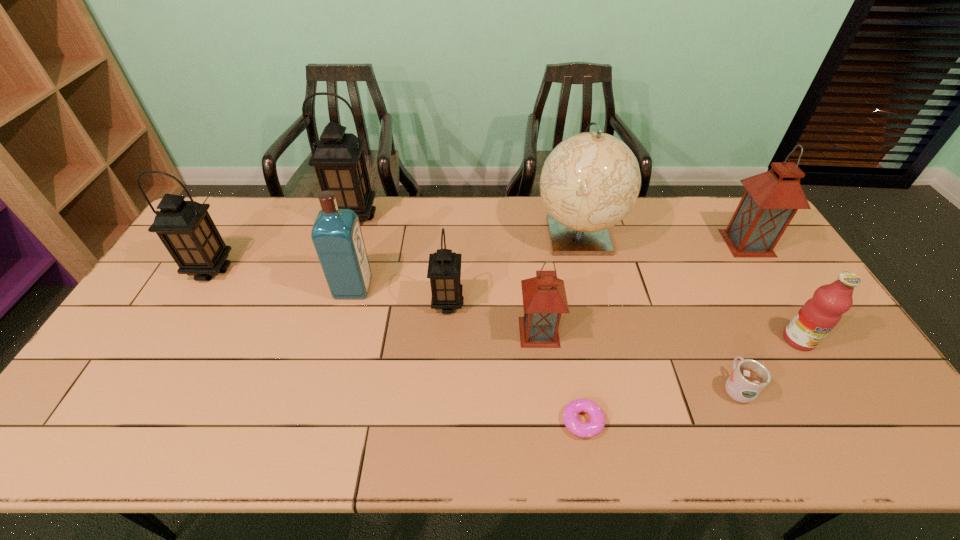
Locate an element on the screen. vacant space situated 0.200m on the front of the second farthest black lantern is located at coordinates (171, 338).

Find the location of a particular element. The width and height of the screenshot is (960, 540). vacant region located on the flat label side of the blue liquor is located at coordinates (430, 288).

Identify the location of free space located 0.310m on the left of the fourth object from left to right. (325, 303).

Identify the location of vacant space located 0.200m on the back of the second lantern from right to left. (532, 267).

You are a GUI agent. You are given a task and a screenshot of the screen. Output one action in this format:
    pyautogui.click(x=<x>, y=<y>)
    Task: Click on the vacant region located 0.180m on the label of the pink fruit juice
    The image size is (960, 540).
    Given the screenshot: What is the action you would take?
    pyautogui.click(x=846, y=416)

Identify the location of vacant space located on the side with the handle of the cup. (679, 261).

Identify the location of vacant space located 0.180m on the side with the handle of the cup. (703, 315).

Image resolution: width=960 pixels, height=540 pixels. What are the coordinates of `vacant space located 0.220m on the side with the handle of the cup` in the screenshot? It's located at (698, 304).

The image size is (960, 540). In order to click on free spot located on the left of the pink doughnut in this screenshot , I will do `click(421, 421)`.

Where is `globe that is at the far edge`? The image size is (960, 540). globe that is at the far edge is located at coordinates (590, 181).